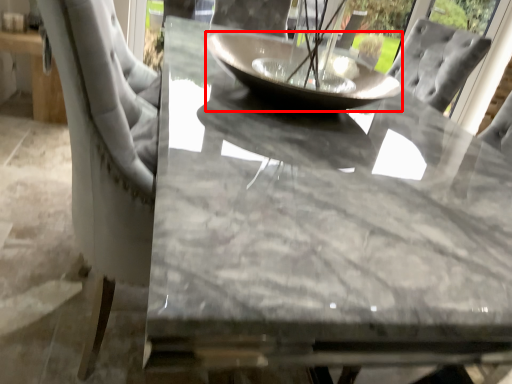
Question: In this image, where is glass bowl (annotated by the red box) located relative to table?

Choices:
 (A) right
 (B) left

Answer: (B)